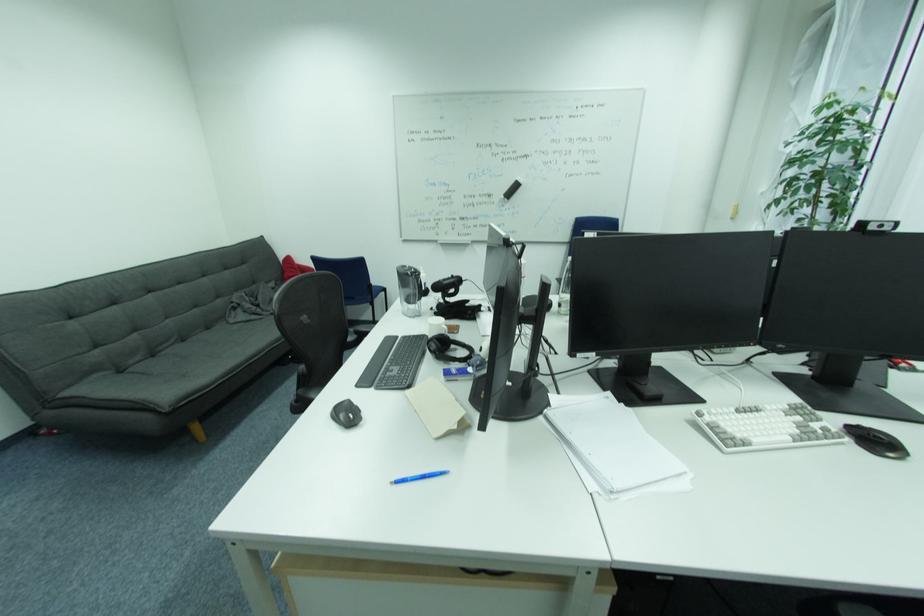
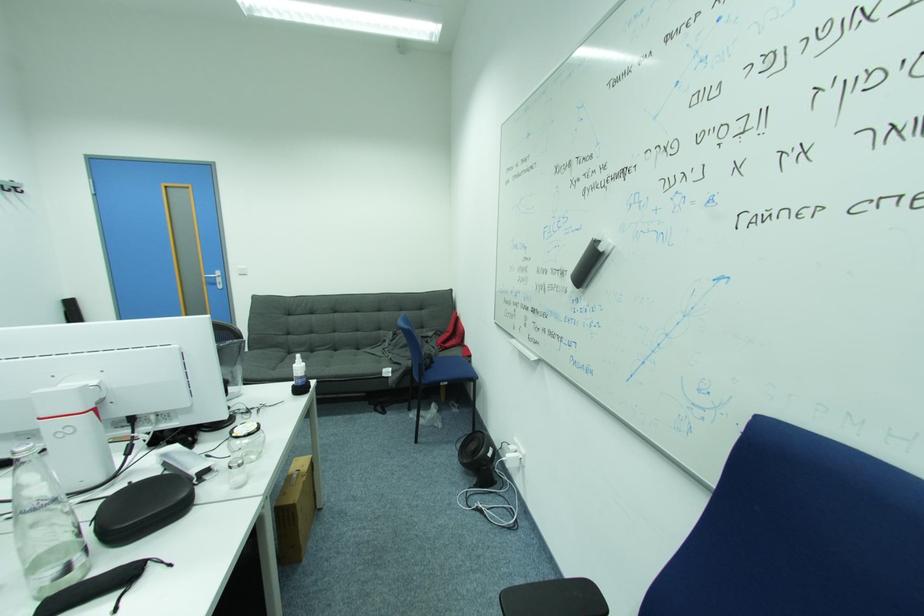
Find the pixel in the second image that matches pixel 236 310 in the first image.

(388, 341)